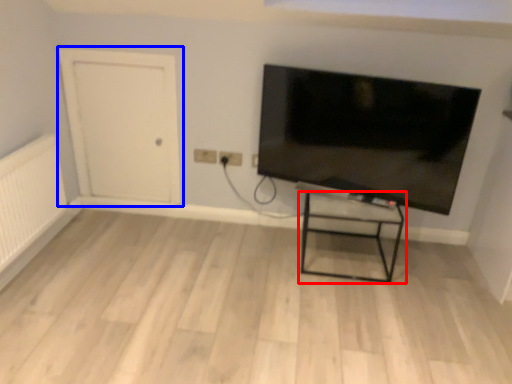
Question: Which of the following is the farthest to the observer, furniture (highlighted by a red box) or door (highlighted by a blue box)?

Choices:
 (A) furniture
 (B) door

Answer: (B)